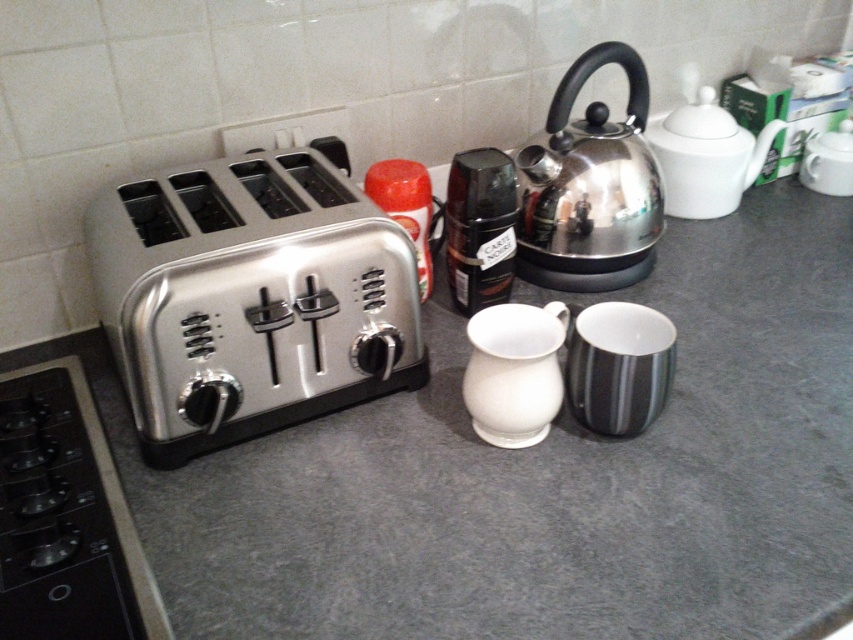
Question: Is satin silver toaster at left positioned before shiny black coffee grinder at center?

Choices:
 (A) no
 (B) yes

Answer: (B)

Question: Which point is closer to the camera?

Choices:
 (A) shiny metallic kettle at upper right
 (B) shiny black coffee grinder at center
 (C) brushed metal toaster at left
 (D) satin silver toaster at left

Answer: (C)

Question: Which object is the farthest from the satin silver toaster at left?

Choices:
 (A) brushed metal toaster at left
 (B) white glossy teapot at upper right
 (C) shiny metallic kettle at upper right

Answer: (B)

Question: Is satin silver toaster at left above shiny black coffee grinder at center?

Choices:
 (A) no
 (B) yes

Answer: (A)

Question: Among these points, which one is farthest from the camera?

Choices:
 (A) (24, 632)
 (B) (664, 129)
 (C) (463, 154)
 (D) (408, 246)

Answer: (B)

Question: Does shiny metallic kettle at upper right appear on the left side of white glossy teapot at upper right?

Choices:
 (A) no
 (B) yes

Answer: (B)